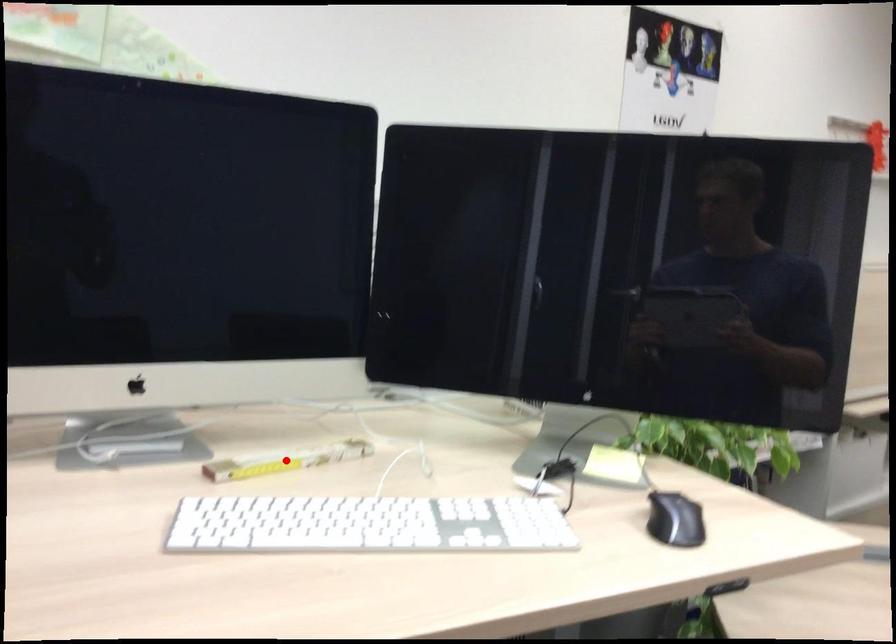
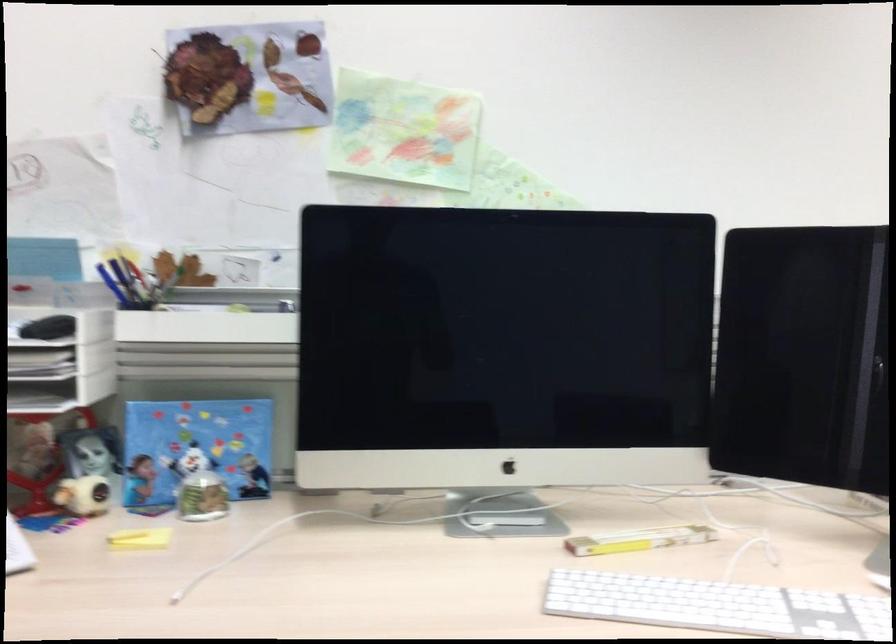
Where in the second image is the point corresponding to the highlighted location from the first image?

(638, 540)